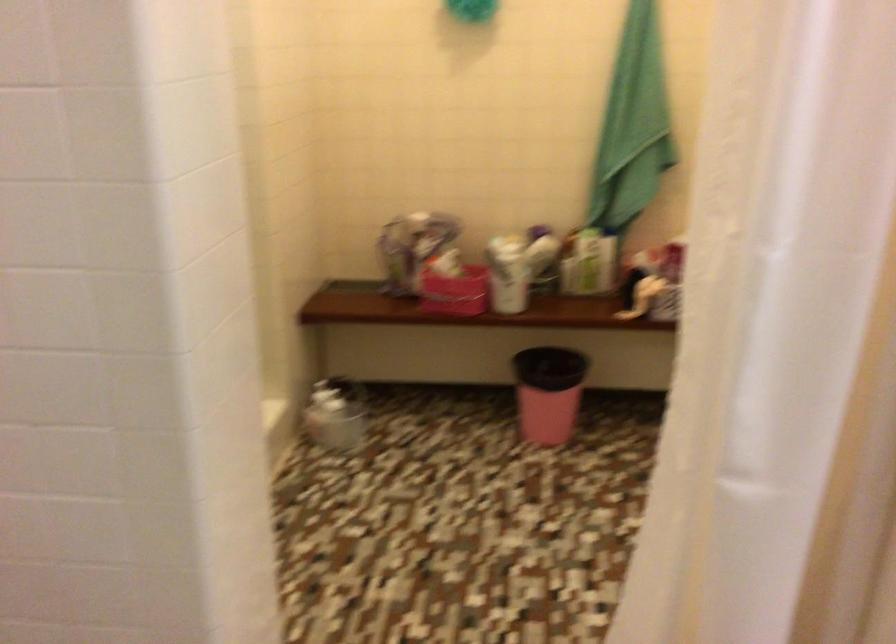
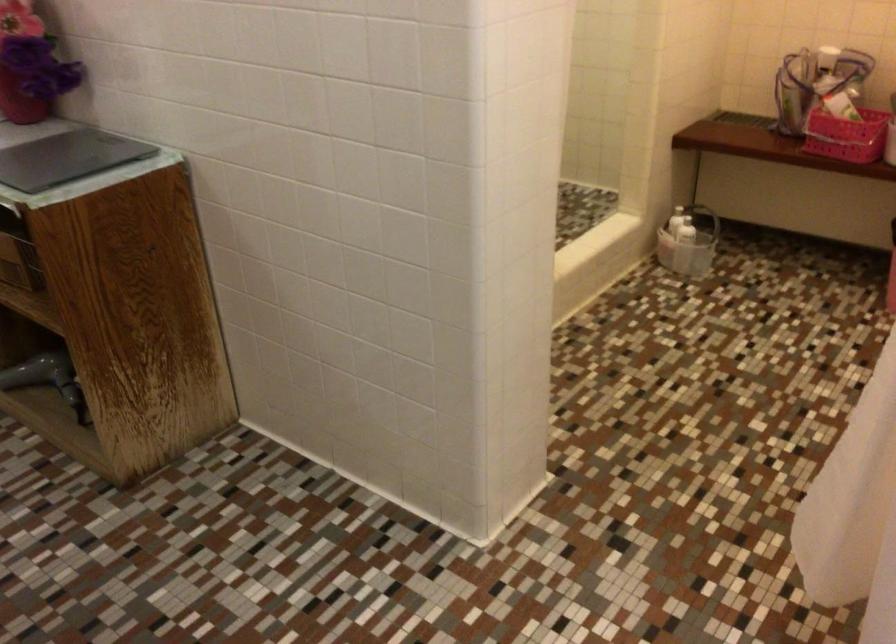
Find the pixel in the second image that matches (415,261) in the first image.

(815, 82)